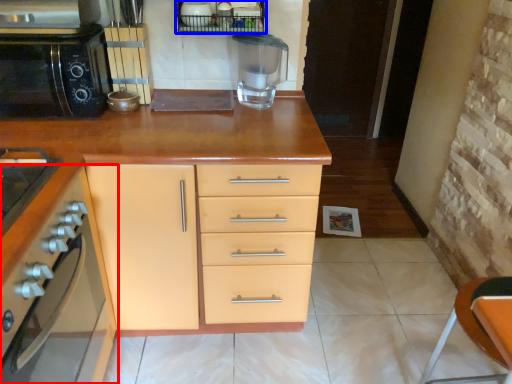
Question: Which point is closer to the camera, cabinetry (highlighted by a red box) or shelf (highlighted by a blue box)?

Choices:
 (A) cabinetry
 (B) shelf

Answer: (A)